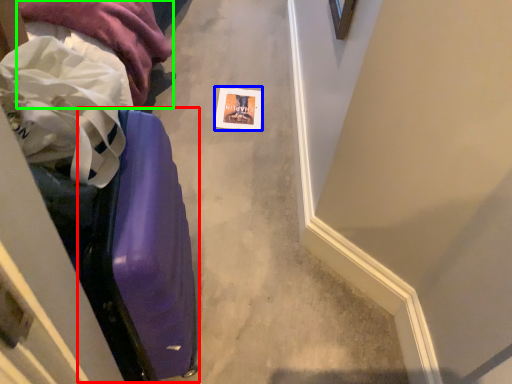
Question: Estimate the real-world distances between objects in this image. Which object is farther from luggage (highlighted by a red box), postcard (highlighted by a blue box) or clothing (highlighted by a green box)?

Choices:
 (A) postcard
 (B) clothing

Answer: (A)